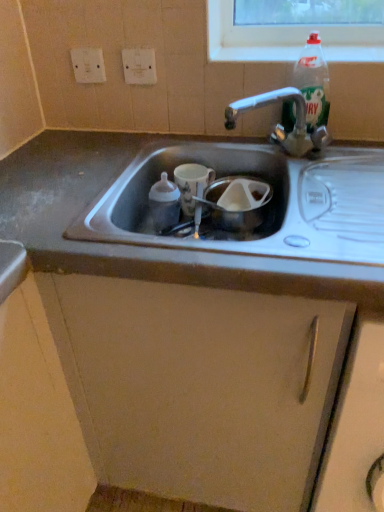
Where is `empty space that is ontop of metallic gray cabinet at center (from a real-world perspective)`? The height and width of the screenshot is (512, 384). empty space that is ontop of metallic gray cabinet at center (from a real-world perspective) is located at coordinates (66, 175).